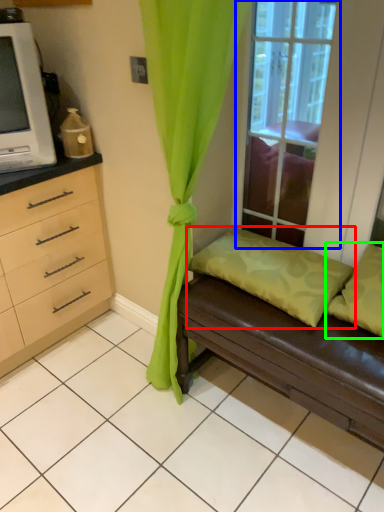
Question: Which object is the closest to the pillow (highlighted by a red box)? Choose among these: window (highlighted by a blue box) or pillow (highlighted by a green box).

Choices:
 (A) window
 (B) pillow

Answer: (B)